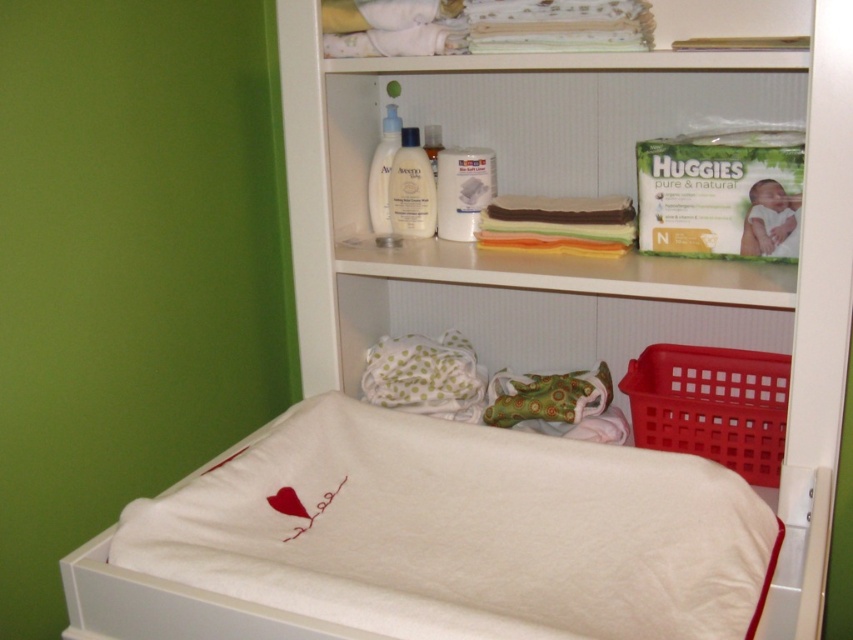
Between white soft fabric infant bed at lower center and white plastic shelf at upper center, which one is positioned lower?

white soft fabric infant bed at lower center

Between white soft fabric infant bed at lower center and white plastic shelf at upper center, which one appears on the right side from the viewer's perspective?

white plastic shelf at upper center

Is point (413, 573) less distant than point (491, 264)?

Yes, it is.

At what (x,y) coordinates should I click in order to perform the action: click on white soft fabric infant bed at lower center. Please return your answer as a coordinate pair (x, y). This screenshot has width=853, height=640. Looking at the image, I should click on (432, 540).

Who is positioned more to the left, red plastic basket at lower right or white cotton folded laundry at upper center?

From the viewer's perspective, white cotton folded laundry at upper center appears more on the left side.

Is point (700, 358) in front of point (604, 40)?

No, it is not.

The image size is (853, 640). I want to click on red plastic basket at lower right, so click(711, 404).

Between white plastic shelf at upper center and red plastic basket at lower right, which one appears on the right side from the viewer's perspective?

From the viewer's perspective, red plastic basket at lower right appears more on the right side.

Which is behind, point (546, 182) or point (670, 362)?

Point (546, 182)

Locate an element on the screen. white plastic shelf at upper center is located at coordinates (552, 168).